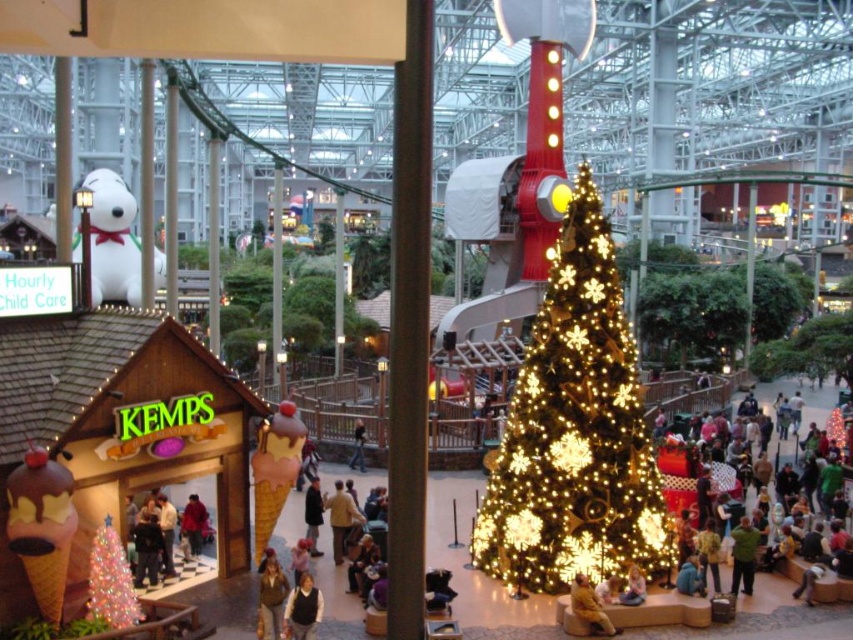
Which of these two, shiny silver christmas tree at lower left or yellow plush bear at lower right, stands taller?

Standing taller between the two is shiny silver christmas tree at lower left.

Is point (125, 608) less distant than point (583, 573)?

Yes, it is.

This screenshot has width=853, height=640. I want to click on shiny silver christmas tree at lower left, so click(x=111, y=580).

Is point (535, 547) positioned in front of point (601, 627)?

No.

Between point (480, 520) and point (590, 624), which one is positioned in front?

Point (590, 624) is in front.

What do you see at coordinates (575, 429) in the screenshot? I see `illuminated gold christmas tree at center` at bounding box center [575, 429].

The height and width of the screenshot is (640, 853). In order to click on illuminated gold christmas tree at center in this screenshot , I will do `click(575, 429)`.

From the picture: Which is more to the left, white plush snowman at left or brown fabric jacket at lower center?

From the viewer's perspective, white plush snowman at left appears more on the left side.

Is point (120, 182) closer to viewer compared to point (312, 636)?

No.

Locate an element on the screen. white plush snowman at left is located at coordinates (112, 240).